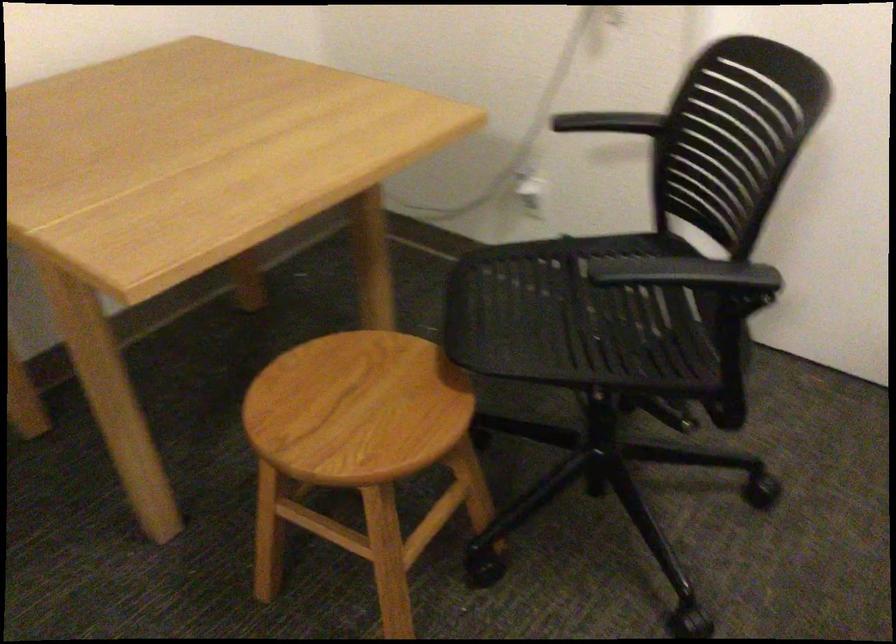
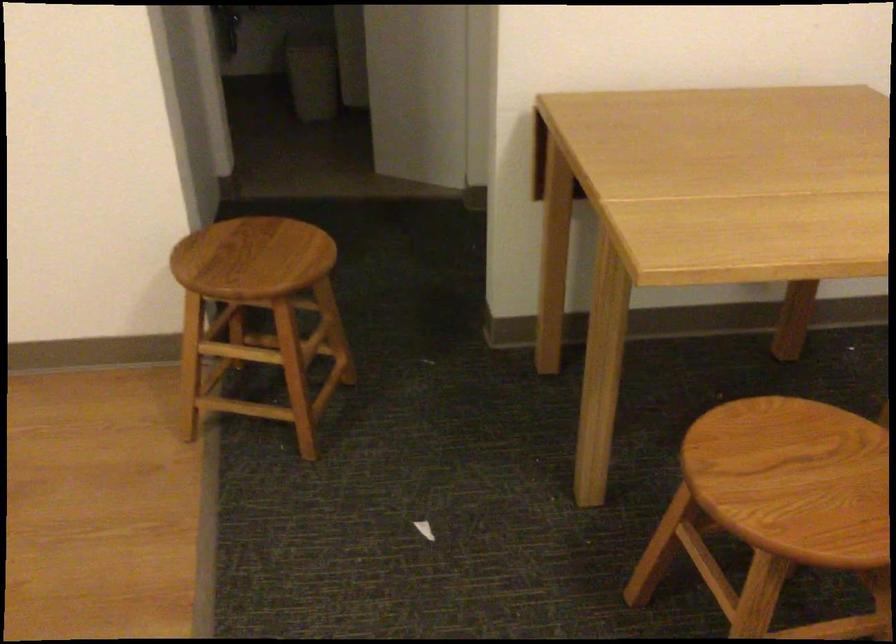
Locate, in the second image, the point that corresponds to (x=358, y=400) in the first image.

(807, 476)